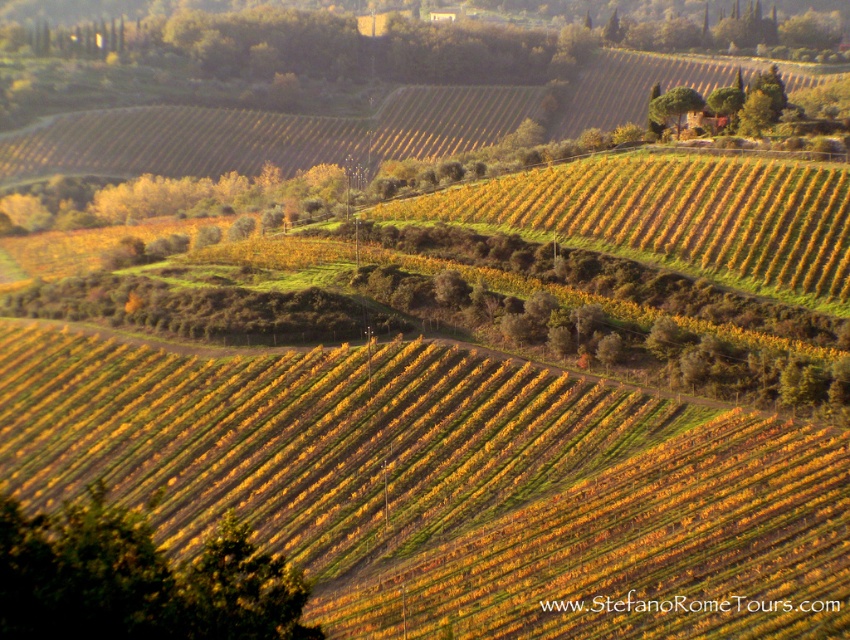
Question: Is green leafy tree at lower left closer to camera compared to green leafy tree at upper center?

Choices:
 (A) no
 (B) yes

Answer: (B)

Question: Does green leafy tree at lower left have a greater width compared to green leafy tree at upper center?

Choices:
 (A) yes
 (B) no

Answer: (A)

Question: Which object appears farthest from the camera in this image?

Choices:
 (A) green leafy tree at upper center
 (B) green leafy tree at lower left

Answer: (A)

Question: Which of the following is the farthest from the observer?

Choices:
 (A) green leafy tree at lower left
 (B) green leafy tree at upper center

Answer: (B)

Question: Is green leafy tree at lower left to the right of green leafy tree at upper center from the viewer's perspective?

Choices:
 (A) yes
 (B) no

Answer: (B)

Question: Which object is farther from the camera taking this photo?

Choices:
 (A) green leafy tree at upper center
 (B) green leafy tree at lower left

Answer: (A)